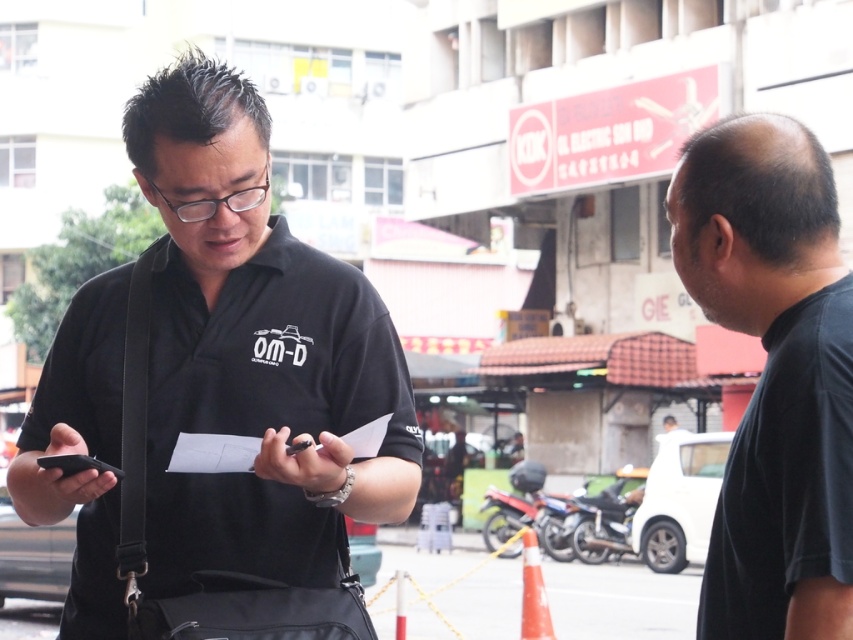
Is black matte shirt at center further to the viewer compared to black matte shirt at right?

Yes.

Can you confirm if black matte shirt at center is wider than black matte shirt at right?

Yes, black matte shirt at center is wider than black matte shirt at right.

Is point (36, 499) behind point (807, 349)?

Yes, point (36, 499) is behind point (807, 349).

This screenshot has height=640, width=853. Find the location of `black matte shirt at center`. black matte shirt at center is located at coordinates (254, 352).

Who is more distant from viewer, (787, 608) or (525, 500)?

The point (525, 500) is more distant.

This screenshot has height=640, width=853. Find the location of `black matte shirt at right`. black matte shirt at right is located at coordinates (775, 374).

Can you confirm if black matte shirt at center is thinner than black matte smartphone at left?

In fact, black matte shirt at center might be wider than black matte smartphone at left.

How far apart are black matte shirt at center and black matte smartphone at left?

black matte shirt at center and black matte smartphone at left are 13.95 inches apart from each other.

Which is in front, point (309, 305) or point (44, 456)?

Point (44, 456)

Identify the location of black matte shirt at center. Image resolution: width=853 pixels, height=640 pixels. (254, 352).